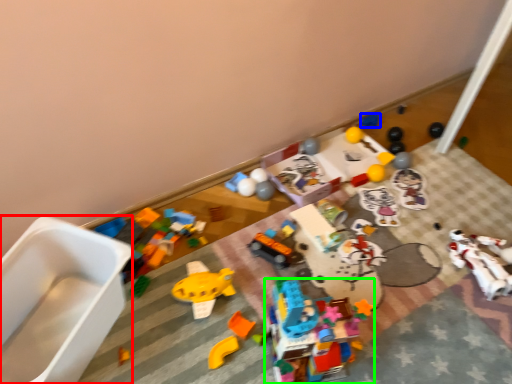
Question: Which object is the closest to the toy (highlighted by a red box)? Choose among these: toy (highlighted by a blue box) or toy (highlighted by a green box).

Choices:
 (A) toy
 (B) toy

Answer: (B)